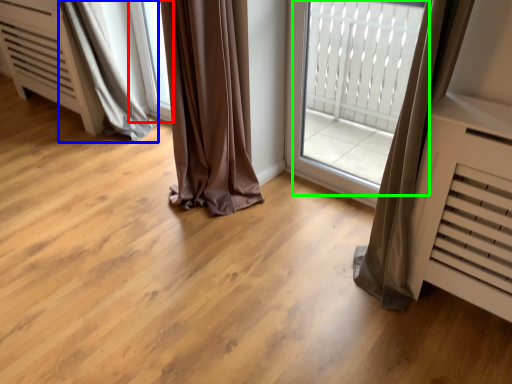
Question: Which is nearer to the window (highlighted by a red box)? curtain (highlighted by a blue box) or bay window (highlighted by a green box).

Choices:
 (A) curtain
 (B) bay window

Answer: (A)